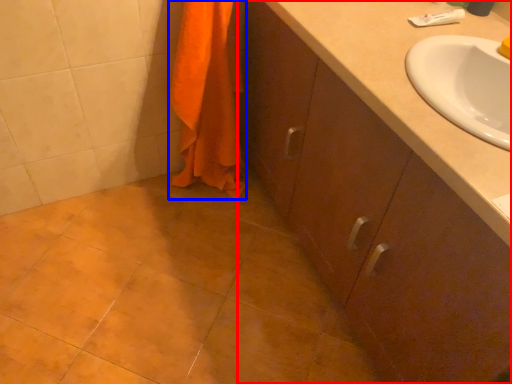
Question: Which object is closer to the camera taking this photo, bathroom cabinet (highlighted by a red box) or bath towel (highlighted by a blue box)?

Choices:
 (A) bathroom cabinet
 (B) bath towel

Answer: (A)